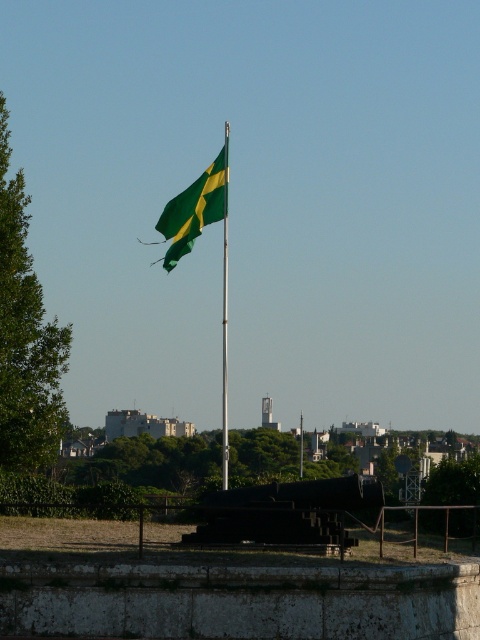
Which is in front, point (175, 196) or point (299, 458)?

Point (299, 458) is in front.

Identify the location of green matte flag at center. (194, 209).